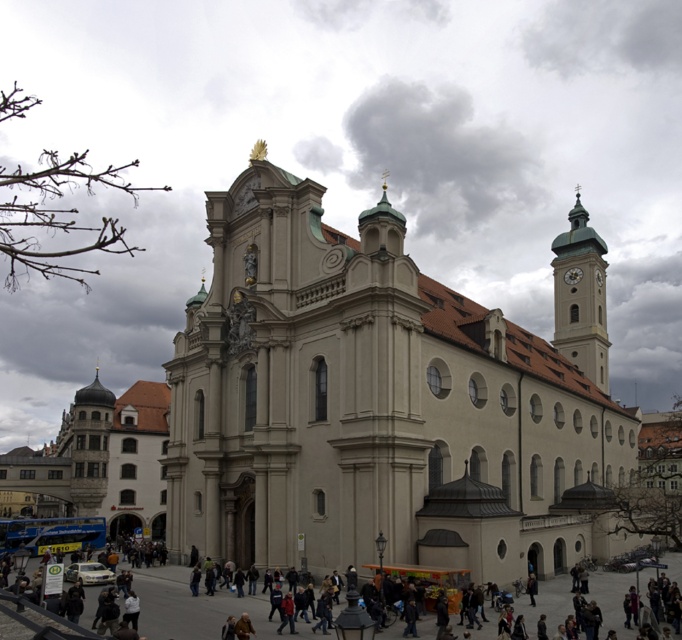
Question: Does concrete pavement at center have a greater width compared to metallic clock tower at upper right?

Choices:
 (A) no
 (B) yes

Answer: (B)

Question: Does green polished stone clock tower at upper right appear over metallic clock tower at upper right?

Choices:
 (A) yes
 (B) no

Answer: (B)

Question: Which point appears farthest from the camera in this image?

Choices:
 (A) (149, 573)
 (B) (574, 282)
 (C) (604, 269)
 (D) (177, 554)

Answer: (C)

Question: Can you confirm if beige stone church at center is bigger than metallic clock tower at upper right?

Choices:
 (A) no
 (B) yes

Answer: (B)

Question: Which object appears closest to the camera in this image?

Choices:
 (A) concrete pavement at center
 (B) green polished stone clock tower at upper right

Answer: (A)

Question: Which point appears closest to the camera in this image?

Choices:
 (A) (578, 276)
 (B) (572, 234)
 (C) (409, 349)
 (D) (342, 593)

Answer: (D)